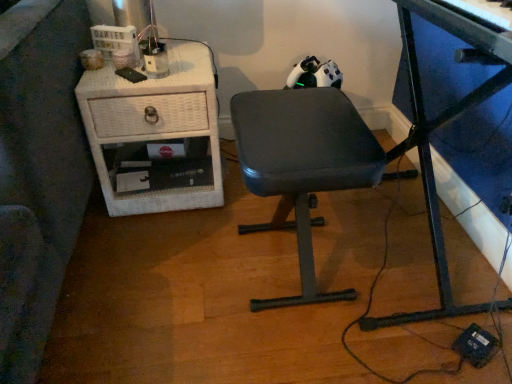
The height and width of the screenshot is (384, 512). Identify the location of free location in front of dark gray fabric chair at center. (283, 352).